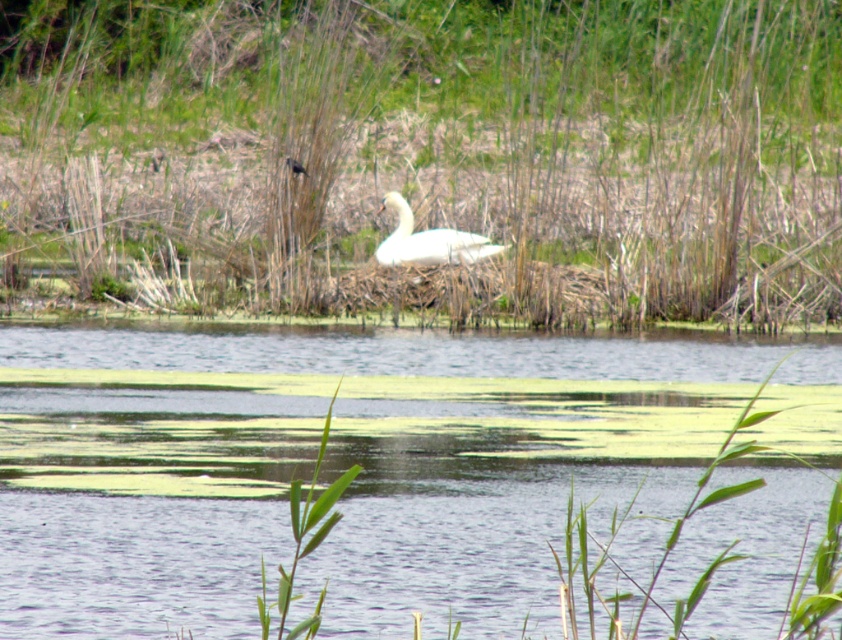
You are a small bird trying to hide from a predator. You see the green grass at center and the white glossy swan at center. Which location would provide better concealment?

The green grass at center is much taller than the white glossy swan at center, so hiding in the green grass at center would provide better concealment as it can obscure your presence more effectively.

You are a photographer standing at the edge of the pond. You want to take a photo that includes both the green grass at center and the silvery metallic bird at center. If your camera has a maximum focus range of 10 meters, will you be able to capture both subjects in focus at the same time?

The distance between the green grass at center and the silvery metallic bird at center is 10.33 meters. Since the camera can only focus up to 10 meters, the subjects are slightly out of the focus range, so you won not be able to capture both in focus simultaneously.

You are a photographer trying to capture a closeup of the silvery metallic bird at center. You notice the green grass at center is blocking your view. Based on their heights, can you adjust your camera angle to see the bird without moving the grass?

The green grass at center is taller than the silvery metallic bird at center, so you might need to lower your camera angle or move closer to the ground to see the bird without obstruction.